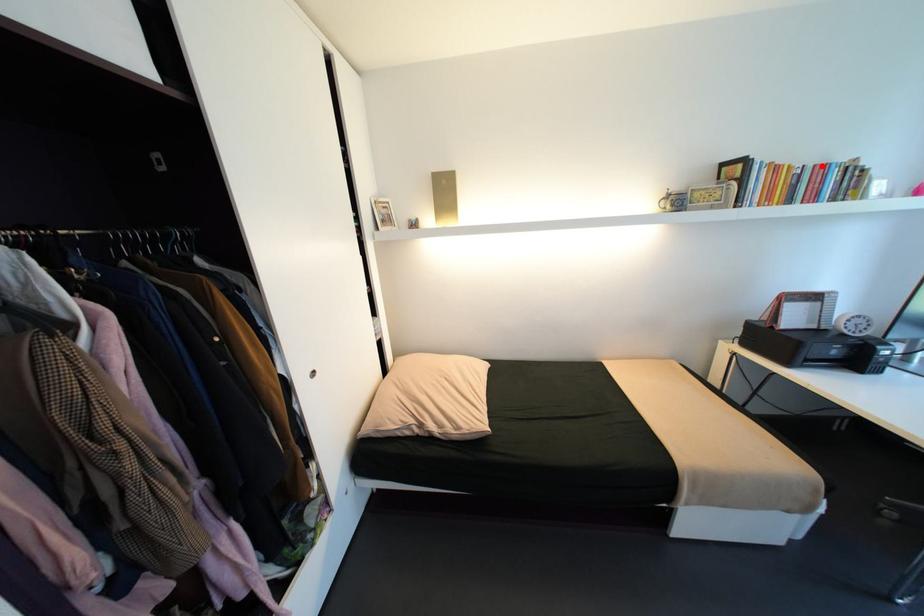
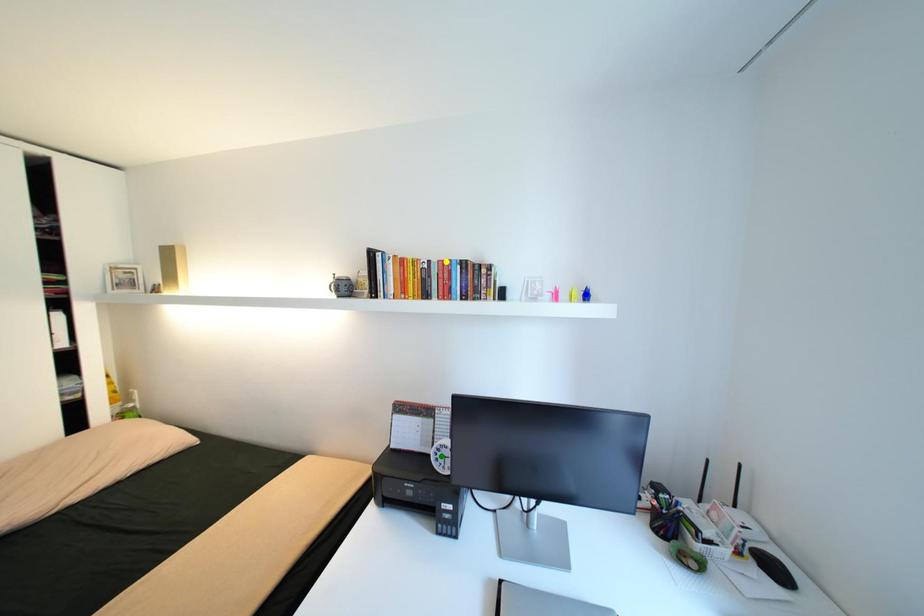
Question: I am providing you with two images of the same scene from different viewpoints. A red point is marked on the first image. You are given multiple points on the second image. Can you choose the point in image 2 that corresponds to the point in image 1?

Choices:
 (A) yellow point
 (B) green point
 (C) blue point

Answer: (A)